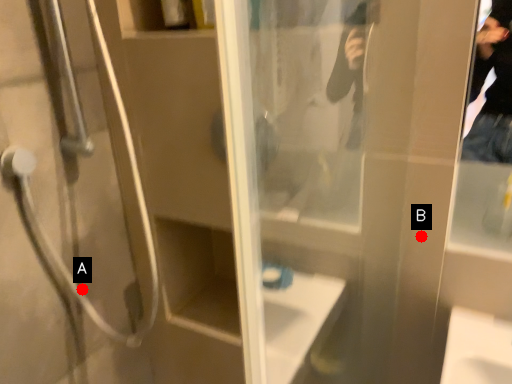
Question: Two points are circled on the image, labeled by A and B beside each circle. Which point is closer to the camera taking this photo?

Choices:
 (A) A is closer
 (B) B is closer

Answer: (B)